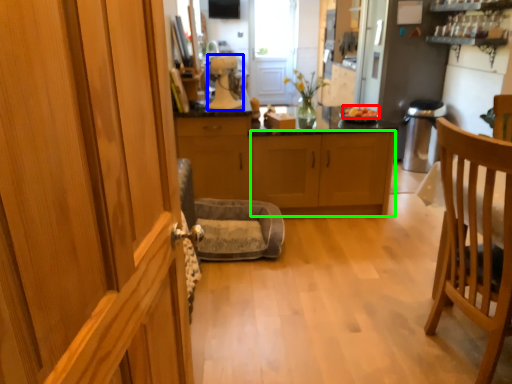
Question: Which object is positioned closest to food (highlighted by a red box)? Select from kitchen appliance (highlighted by a blue box) and cabinetry (highlighted by a green box).

Choices:
 (A) kitchen appliance
 (B) cabinetry

Answer: (B)